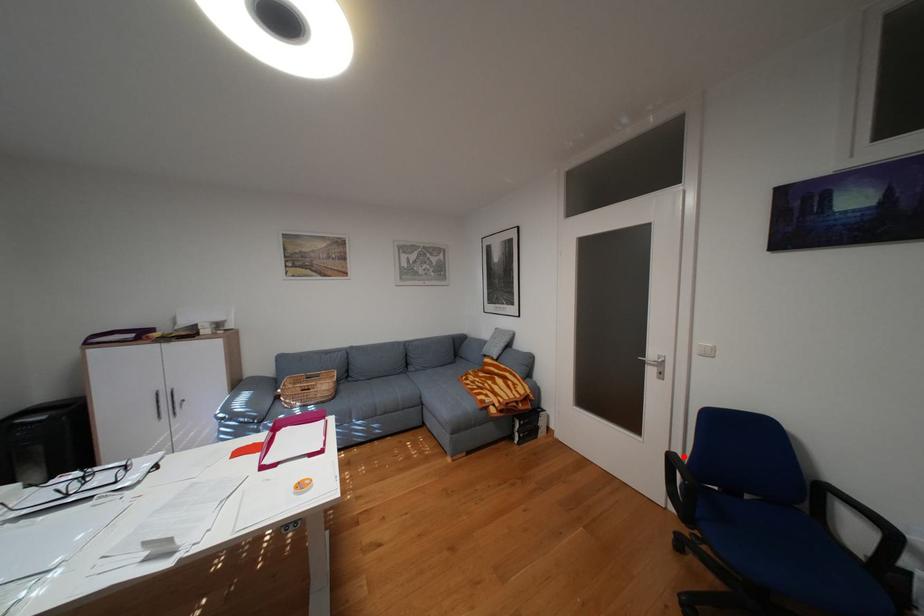
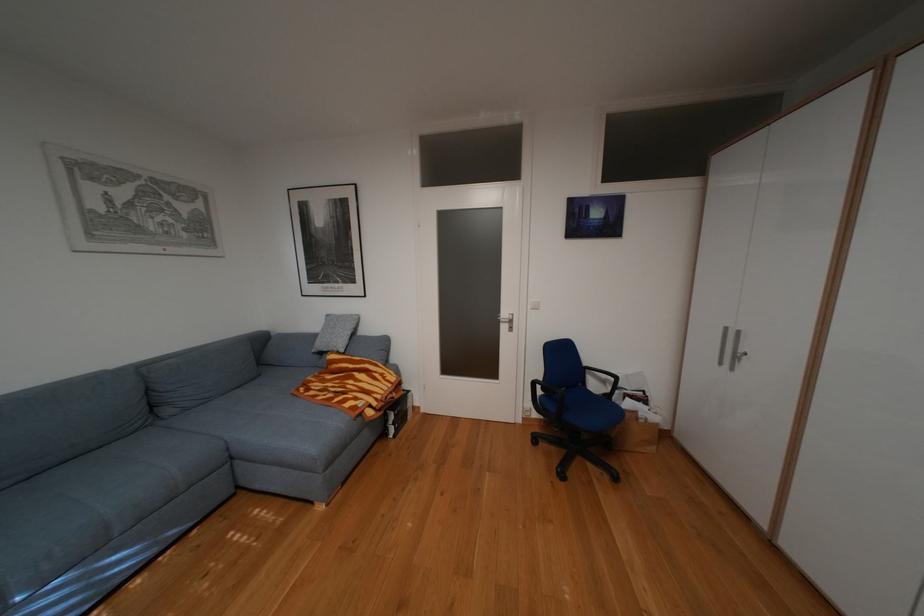
Question: I am providing you with two images of the same scene from different viewpoints. A red point is shown in image1. For the corresponding object point in image2, is it positioned nearer or farther from the camera?

Choices:
 (A) Nearer
 (B) Farther

Answer: (B)